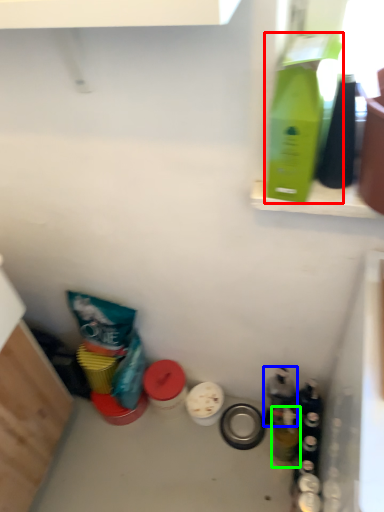
Question: Based on their relative distances, which object is nearer to bottle (highlighted by a red box)? Choose from bottle (highlighted by a blue box) and bottle (highlighted by a green box).

Choices:
 (A) bottle
 (B) bottle

Answer: (A)